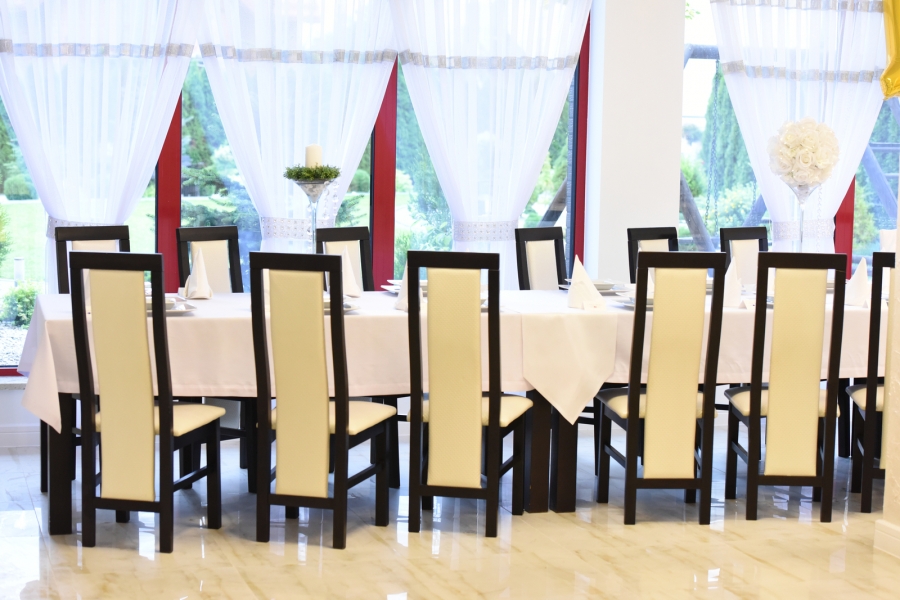
The height and width of the screenshot is (600, 900). What are the coordinates of `chairs on the far side of the table` in the screenshot? It's located at (72, 232), (216, 235), (349, 240), (544, 241), (661, 242), (743, 253).